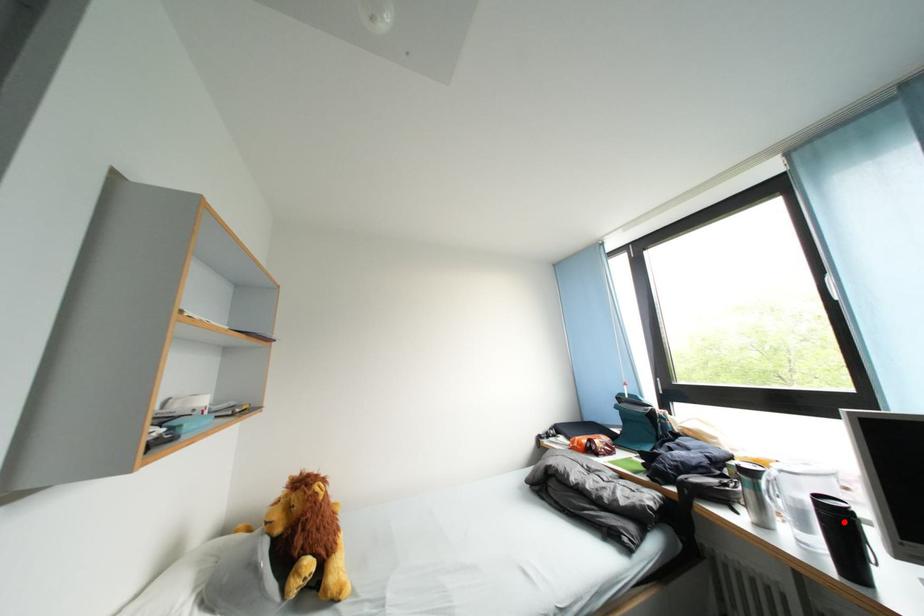
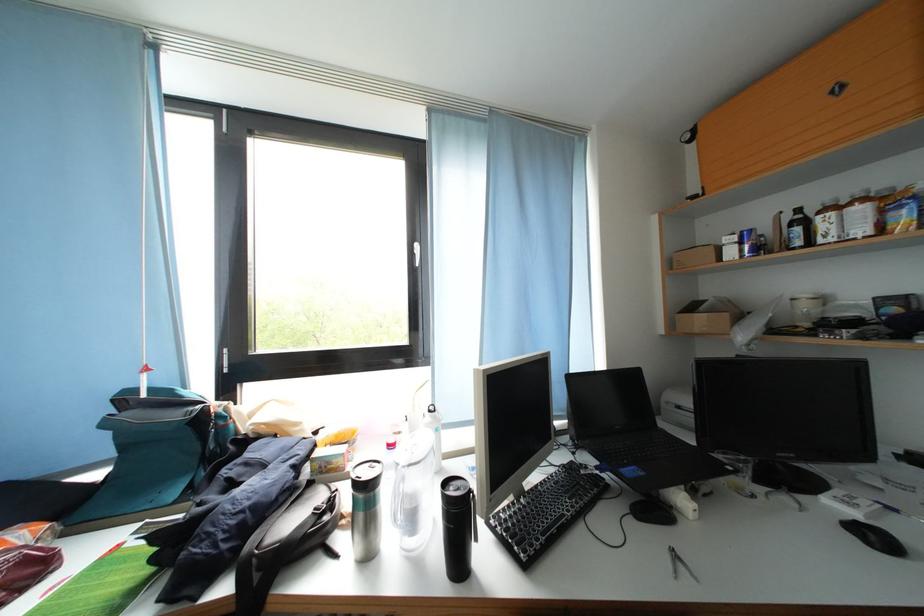
In the second image, find the point that corresponds to the highlighted location in the first image.

(470, 514)